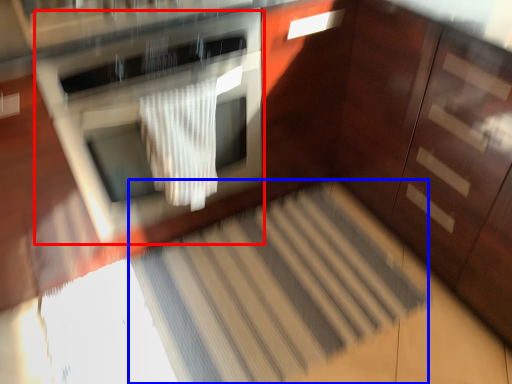
Question: Which point is closer to the camera, oven (highlighted by a red box) or stair (highlighted by a blue box)?

Choices:
 (A) oven
 (B) stair

Answer: (A)